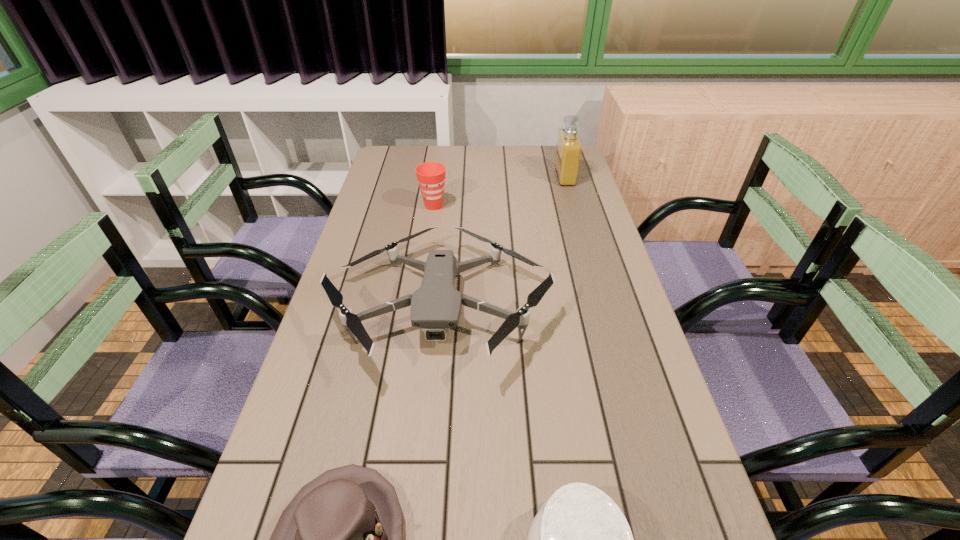
Point out which object is positioned as the fourth nearest to the left hat. Please provide its 2D coordinates. Your answer should be formatted as a tuple, i.e. [(x, y)], where the tuple contains the x and y coordinates of a point satisfying the conditions above.

[(569, 148)]

You are a GUI agent. You are given a task and a screenshot of the screen. Output one action in this format:
    pyautogui.click(x=<x>, y=<y>)
    Task: Click on the free location that satisfies the following two spatial constraints: 1. on the front-facing side of the tallest object; 2. on the front-facing side of the third tallest object
    
    Given the screenshot: What is the action you would take?
    pyautogui.click(x=602, y=306)